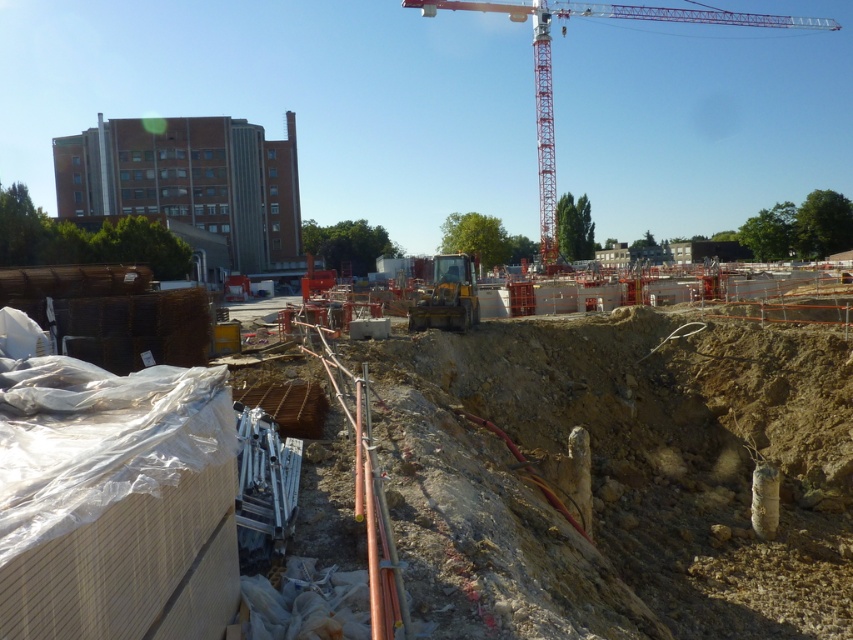
Which is below, brown dirt at center or red metallic crane at upper center?

brown dirt at center is lower down.

Which of these two, brown dirt at center or red metallic crane at upper center, stands shorter?

brown dirt at center is shorter.

Which is behind, point (787, 412) or point (438, 3)?

Point (438, 3)

Where is `brown dirt at center`? The width and height of the screenshot is (853, 640). brown dirt at center is located at coordinates (618, 474).